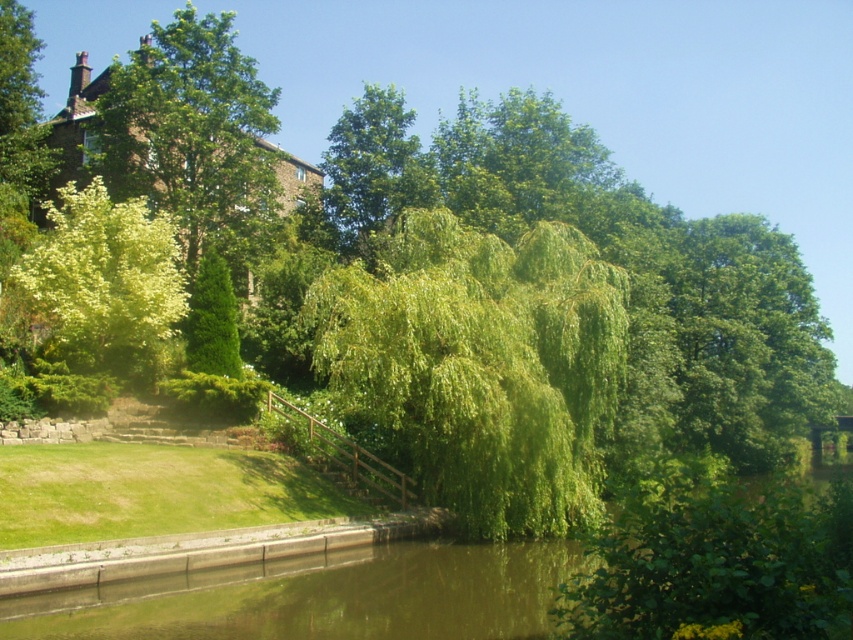
Question: Which object appears farthest from the camera in this image?

Choices:
 (A) green leafy tree at upper left
 (B) green leafy willow at left
 (C) green leafy willow at center

Answer: (A)

Question: Is green leafy willow at center above green leafy willow at left?

Choices:
 (A) no
 (B) yes

Answer: (A)

Question: Which point is closer to the camera?

Choices:
 (A) green leafy willow at center
 (B) green leafy tree at upper left

Answer: (A)

Question: Considering the relative positions of green leafy tree at upper left and green leafy willow at left in the image provided, where is green leafy tree at upper left located with respect to green leafy willow at left?

Choices:
 (A) above
 (B) below

Answer: (A)

Question: Can you confirm if green leafy tree at upper left is positioned to the left of green leafy willow at left?

Choices:
 (A) no
 (B) yes

Answer: (B)

Question: Estimate the real-world distances between objects in this image. Which object is closer to the green leafy willow at center?

Choices:
 (A) green leafy willow at left
 (B) green leafy tree at upper left

Answer: (A)